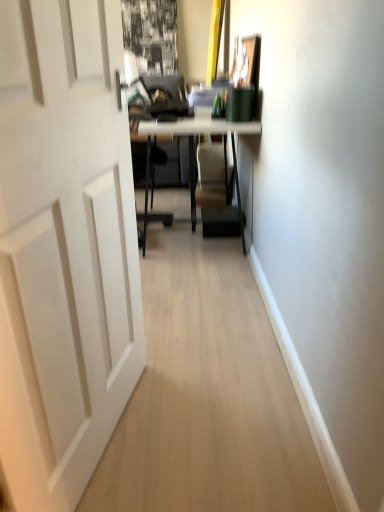
This screenshot has width=384, height=512. What are the coordinates of `spots to the right of white matte door at left` in the screenshot? It's located at (213, 430).